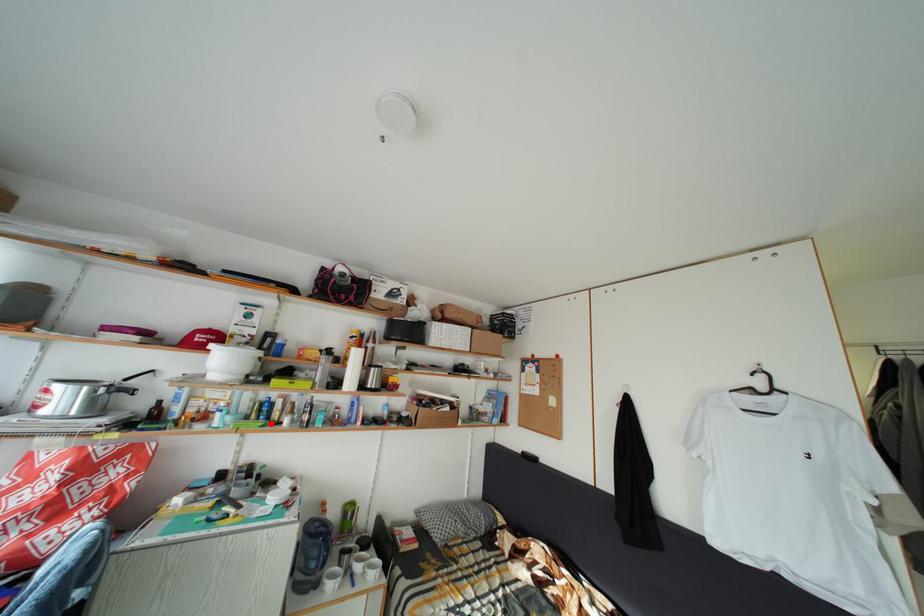
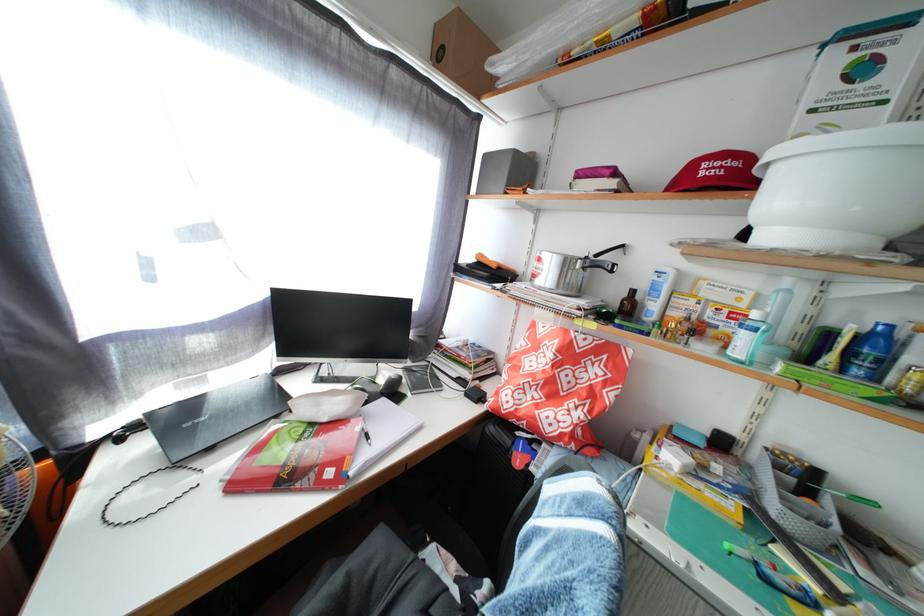
Where in the second image is the point corresponding to the highlighted location from the first image?

(866, 378)